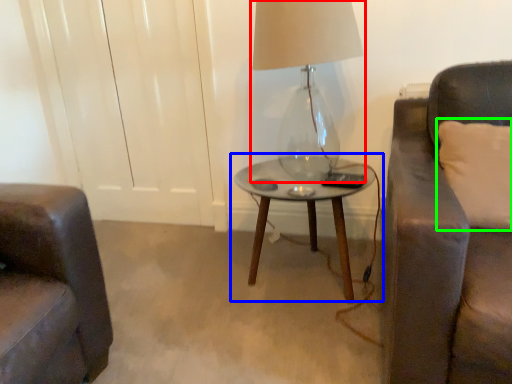
Question: Estimate the real-world distances between objects in this image. Which object is farther from lamp (highlighted by a red box), table (highlighted by a blue box) or pillow (highlighted by a green box)?

Choices:
 (A) table
 (B) pillow

Answer: (B)